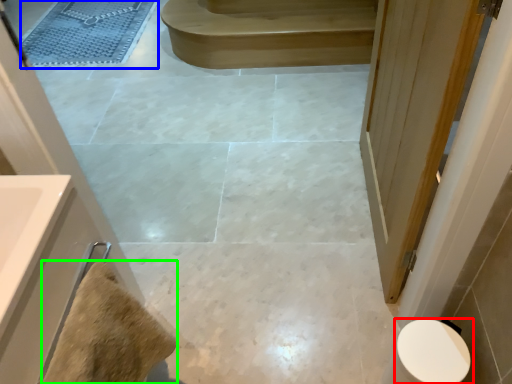
Question: Which object is positioned farthest from toilet (highlighted by a red box)? Select from bath mat (highlighted by a blue box) and material (highlighted by a green box).

Choices:
 (A) bath mat
 (B) material

Answer: (A)